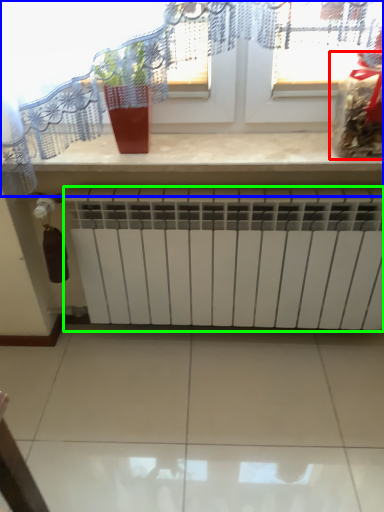
Question: Considering the real-world distances, which object is closest to food (highlighted by a red box)? window (highlighted by a blue box) or radiator (highlighted by a green box).

Choices:
 (A) window
 (B) radiator

Answer: (A)